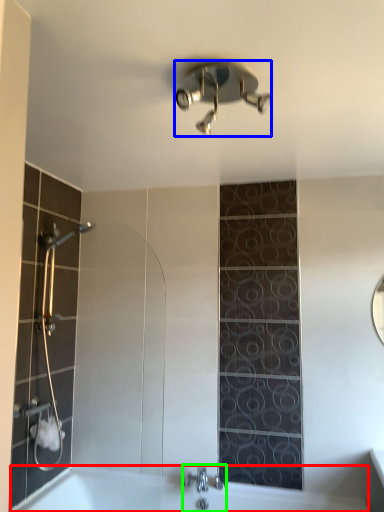
Question: Which is farther away from bath (highlighted by a red box)? shower (highlighted by a blue box) or tap (highlighted by a green box)?

Choices:
 (A) shower
 (B) tap

Answer: (A)